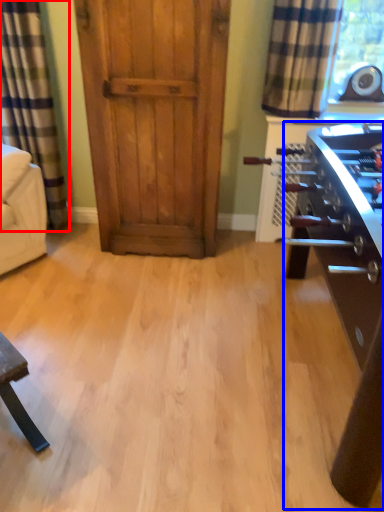
Question: Which point is closer to the camera, curtain (highlighted by a red box) or table (highlighted by a blue box)?

Choices:
 (A) curtain
 (B) table

Answer: (B)